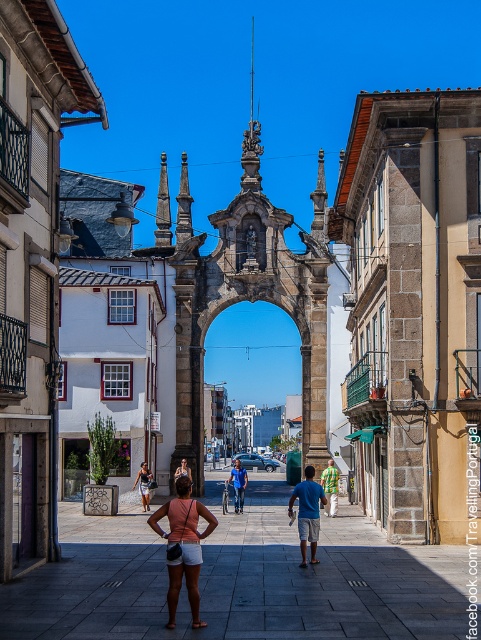
Question: Is matte pink shirt at center bigger than blue denim jeans at center?

Choices:
 (A) yes
 (B) no

Answer: (A)

Question: Which object is positioned closest to the green plaid shirt at center?

Choices:
 (A) stone carved archway at center
 (B) matte black shorts at center
 (C) orange matte shorts at center

Answer: (B)

Question: Can you confirm if blue cotton shirt at center is positioned to the right of matte black shorts at center?

Choices:
 (A) yes
 (B) no

Answer: (A)

Question: Is stone carved archway at center in front of orange matte shorts at center?

Choices:
 (A) yes
 (B) no

Answer: (B)

Question: Which object is positioned farthest from the smooth stone alley at center?

Choices:
 (A) orange matte shorts at center
 (B) blue cotton shirt at center
 (C) matte pink shirt at center
 (D) blue denim jeans at center

Answer: (D)

Question: Which of these objects is positioned farthest from the matte pink shirt at center?

Choices:
 (A) stone carved archway at center
 (B) orange matte shorts at center
 (C) blue cotton shirt at center

Answer: (A)